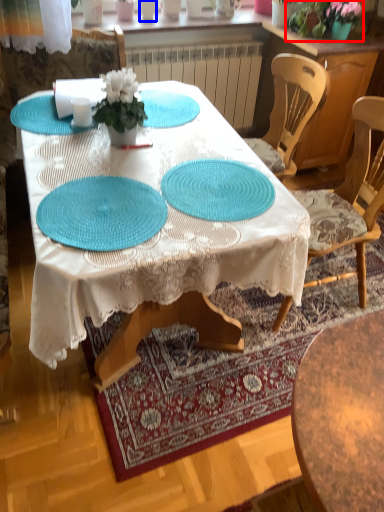
Question: Among these objects, which one is nearest to the camera, floral arrangement (highlighted by a red box) or tableware (highlighted by a blue box)?

Choices:
 (A) floral arrangement
 (B) tableware

Answer: (A)